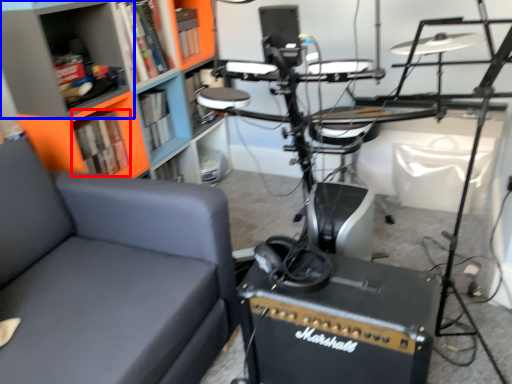
Question: Among these objects, which one is nearest to the camera, book (highlighted by a red box) or shelf (highlighted by a blue box)?

Choices:
 (A) book
 (B) shelf

Answer: (B)